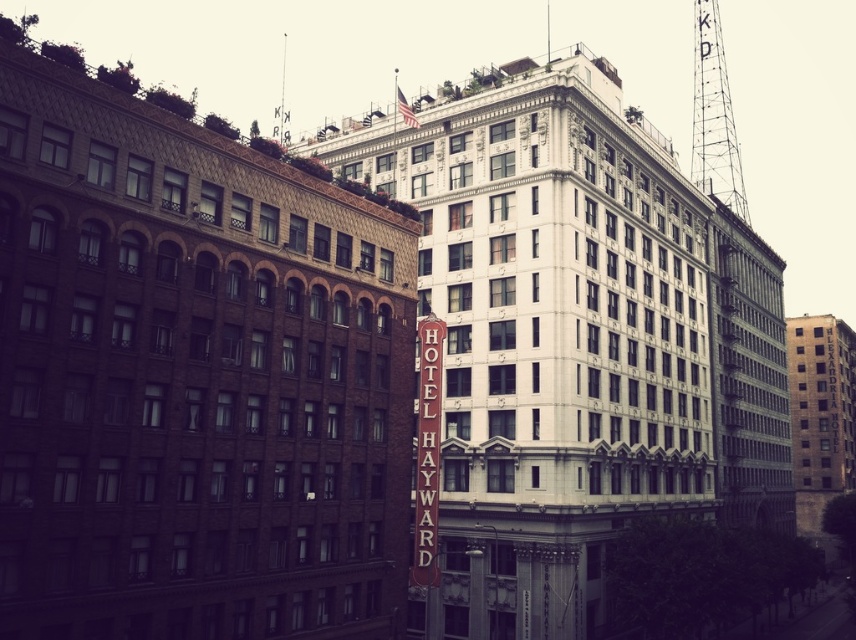
Who is positioned more to the left, brown stone building at right or brown wooden sign at center?

From the viewer's perspective, brown wooden sign at center appears more on the left side.

Is point (837, 330) positioned before point (429, 314)?

No.

Which is behind, point (835, 480) or point (431, 497)?

The point (835, 480) is behind.

At what (x,y) coordinates should I click in order to perform the action: click on brown stone building at right. Please return your answer as a coordinate pair (x, y). The height and width of the screenshot is (640, 856). Looking at the image, I should click on (819, 416).

Can you confirm if metallic tower at upper right is positioned to the left of brown wooden sign at center?

In fact, metallic tower at upper right is to the right of brown wooden sign at center.

Is point (718, 77) closer to camera compared to point (434, 353)?

No.

Identify the location of metallic tower at upper right. The width and height of the screenshot is (856, 640). pos(714,116).

Does brown stone building at right appear on the right side of metallic tower at upper right?

In fact, brown stone building at right is to the left of metallic tower at upper right.

Does point (831, 497) lie behind point (715, 124)?

No, (831, 497) is closer to viewer.

Does point (815, 339) come farther from viewer compared to point (714, 74)?

That is False.

Where is `brown stone building at right`? brown stone building at right is located at coordinates (819, 416).